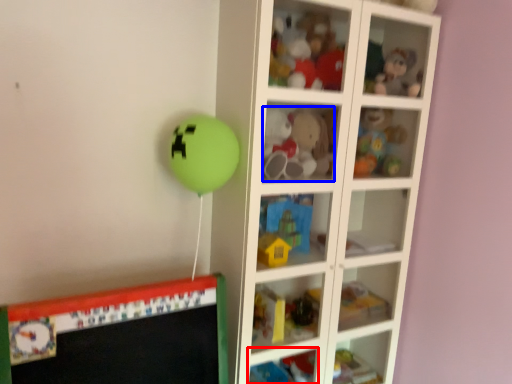
Question: Which object appears closest to the camera in this image, cabinet (highlighted by a red box) or toy (highlighted by a blue box)?

Choices:
 (A) cabinet
 (B) toy

Answer: (B)